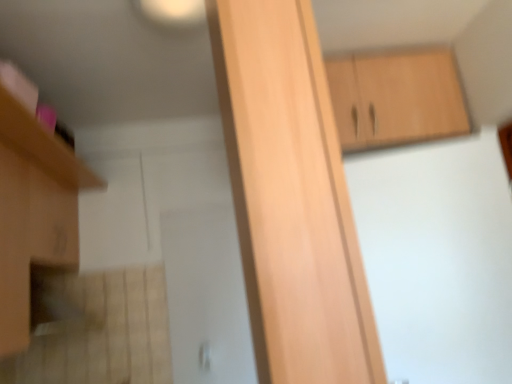
Question: Is matte wood cabinet at left, marked as the second cabinetry in a back-to-front arrangement, turned away from light wood cabinet at center, arranged as the 2th cabinetry when viewed from the right?

Choices:
 (A) no
 (B) yes

Answer: (A)

Question: Does matte wood cabinet at left, marked as the second cabinetry in a back-to-front arrangement, appear on the left side of light wood cabinet at center, arranged as the 1th cabinetry when viewed from the front?

Choices:
 (A) yes
 (B) no

Answer: (A)

Question: From a real-world perspective, is matte wood cabinet at left, acting as the 3th cabinetry starting from the right, physically above light wood cabinet at center, arranged as the 2th cabinetry when viewed from the right?

Choices:
 (A) no
 (B) yes

Answer: (B)

Question: From the image's perspective, is matte wood cabinet at left, placed as the first cabinetry when sorted from left to right, above light wood cabinet at center, which is the 2th cabinetry in left-to-right order?

Choices:
 (A) yes
 (B) no

Answer: (B)

Question: Can you confirm if matte wood cabinet at left, marked as the second cabinetry in a front-to-back arrangement, is taller than light wood cabinet at center, arranged as the 2th cabinetry when viewed from the right?

Choices:
 (A) yes
 (B) no

Answer: (A)

Question: Is point (329, 66) closer or farther from the camera than point (60, 170)?

Choices:
 (A) closer
 (B) farther

Answer: (A)

Question: Is light brown wood cabinet at upper right, the 3th cabinetry viewed from the front, in front of or behind matte wood cabinet at left, acting as the 3th cabinetry starting from the right, in the image?

Choices:
 (A) behind
 (B) front

Answer: (A)

Question: In the image, is light brown wood cabinet at upper right, placed as the first cabinetry when sorted from back to front, on the left side or the right side of matte wood cabinet at left, placed as the first cabinetry when sorted from left to right?

Choices:
 (A) right
 (B) left

Answer: (A)

Question: Considering the positions of light brown wood cabinet at upper right, placed as the first cabinetry when sorted from back to front, and matte wood cabinet at left, marked as the second cabinetry in a back-to-front arrangement, in the image, is light brown wood cabinet at upper right, placed as the first cabinetry when sorted from back to front, bigger or smaller than matte wood cabinet at left, marked as the second cabinetry in a back-to-front arrangement,?

Choices:
 (A) big
 (B) small

Answer: (B)

Question: Considering their positions, is matte wood cabinet at left, acting as the 3th cabinetry starting from the right, located in front of or behind light brown wood cabinet at upper right, placed as the first cabinetry when sorted from back to front?

Choices:
 (A) behind
 (B) front

Answer: (B)

Question: Is matte wood cabinet at left, marked as the second cabinetry in a front-to-back arrangement, taller or shorter than light brown wood cabinet at upper right, which ranks as the 3th cabinetry in left-to-right order?

Choices:
 (A) short
 (B) tall

Answer: (B)

Question: Choose the correct answer: Is matte wood cabinet at left, marked as the second cabinetry in a back-to-front arrangement, inside light brown wood cabinet at upper right, which ranks as the first cabinetry in right-to-left order, or outside it?

Choices:
 (A) inside
 (B) outside

Answer: (B)

Question: From the image's perspective, relative to light brown wood cabinet at upper right, the 3th cabinetry viewed from the front, is matte wood cabinet at left, marked as the second cabinetry in a front-to-back arrangement, above or below?

Choices:
 (A) below
 (B) above

Answer: (A)

Question: Considering the relative positions of light wood cabinet at center, arranged as the 2th cabinetry when viewed from the right, and light brown wood cabinet at upper right, which ranks as the first cabinetry in right-to-left order, in the image provided, is light wood cabinet at center, arranged as the 2th cabinetry when viewed from the right, to the left or to the right of light brown wood cabinet at upper right, which ranks as the first cabinetry in right-to-left order,?

Choices:
 (A) left
 (B) right

Answer: (A)

Question: From a real-world perspective, is light wood cabinet at center, which is the 2th cabinetry in left-to-right order, physically located above or below light brown wood cabinet at upper right, the 3th cabinetry viewed from the front?

Choices:
 (A) below
 (B) above

Answer: (A)